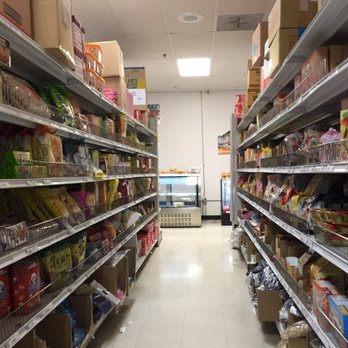
The width and height of the screenshot is (348, 348). Identify the location of gray ceiling. (178, 30).